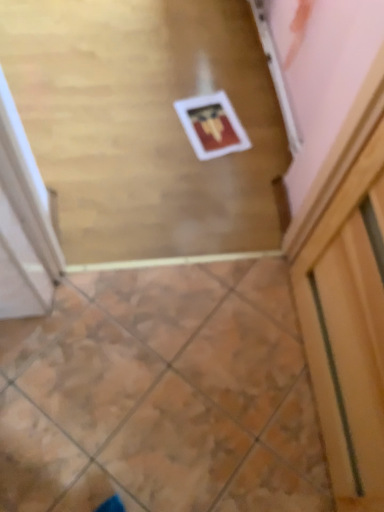
Find the location of a particular element. The image size is (384, 512). wooden floor at center is located at coordinates (145, 124).

In order to face wooden floor at center, should I rotate leftwards or rightwards?

A 6.866 degree turn to the left will do.

The height and width of the screenshot is (512, 384). Describe the element at coordinates (145, 124) in the screenshot. I see `wooden floor at center` at that location.

Find the location of a particular element. This screenshot has width=384, height=512. wooden floor at center is located at coordinates (145, 124).